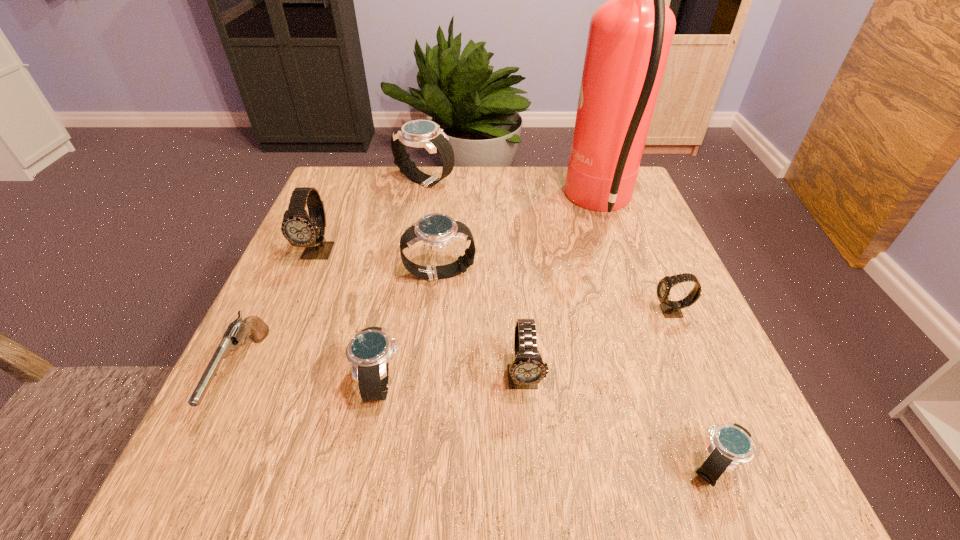
You are a GUI agent. You are given a task and a screenshot of the screen. Output one action in this format:
    pyautogui.click(x=<x>, y=<y>)
    Task: Click on the free space that satisfies the following two spatial constraints: 1. towards the nozzle of the fire extinguisher; 2. on the face of the biggest gray watch
    
    Given the screenshot: What is the action you would take?
    pyautogui.click(x=618, y=252)

Where is `vacant space that satisfies the following two spatial constraints: 1. on the face of the farthest gray watch; 2. on the left side of the nearest watch`? Image resolution: width=960 pixels, height=540 pixels. vacant space that satisfies the following two spatial constraints: 1. on the face of the farthest gray watch; 2. on the left side of the nearest watch is located at coordinates (229, 467).

Image resolution: width=960 pixels, height=540 pixels. In order to click on free space in the image that satisfies the following two spatial constraints: 1. towards the nozzle of the fire extinguisher; 2. on the right side of the nearest object in this screenshot , I will do `click(695, 467)`.